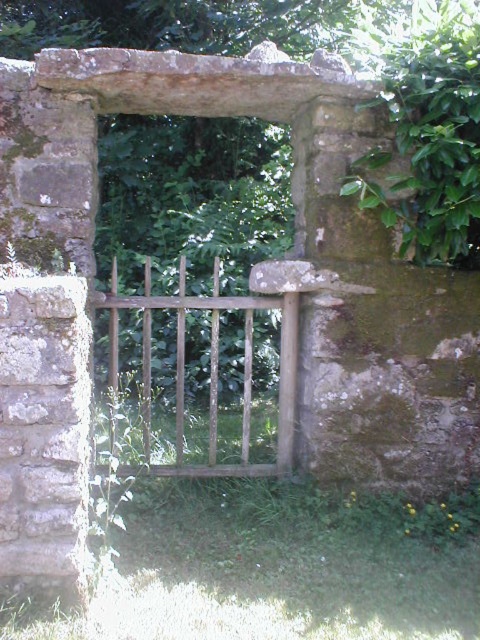
Question: Which point is closer to the camera?

Choices:
 (A) green grass at center
 (B) wooden gate at center

Answer: (A)

Question: Among these points, which one is farthest from the camera?

Choices:
 (A) (279, 500)
 (B) (144, 368)

Answer: (B)

Question: Can you confirm if green grass at center is positioned below wooden gate at center?

Choices:
 (A) yes
 (B) no

Answer: (A)

Question: Can you confirm if green grass at center is smaller than wooden gate at center?

Choices:
 (A) yes
 (B) no

Answer: (A)

Question: Does green grass at center appear under wooden gate at center?

Choices:
 (A) yes
 (B) no

Answer: (A)